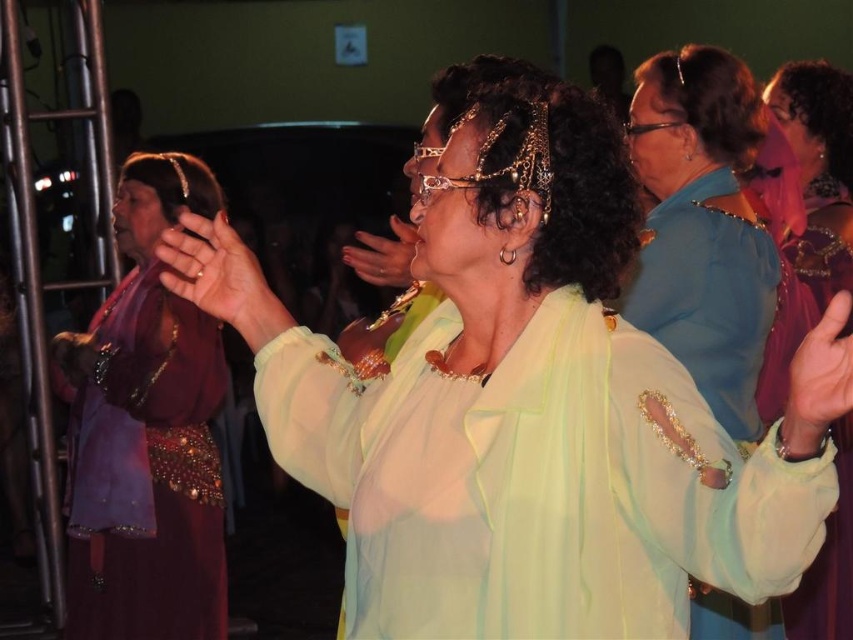
You are a photographer trying to capture the best shot of the two dancers. You notice two points in the image labeled as point (x=82, y=497) and point (x=721, y=67). Which point is closer to the camera?

Point (x=721, y=67) is closer to the camera since the description states that point (x=82, y=497) is behind it.

You are a photographer trying to capture the shiny gold necklace at upper right and the smooth skin hand at center in a single frame. Based on their sizes in the image, which object would appear larger in your photo?

The shiny gold necklace at upper right appears larger in the photo because it is much taller than the smooth skin hand at center.

Consider the image. You are observing the dancers and want to know which of the two points, point (798, 189) or point (836, 378), is closer to you. Can you determine this based on their positions?

Point (798, 189) is further to the viewer than point (836, 378), so point (836, 378) is closer to you.